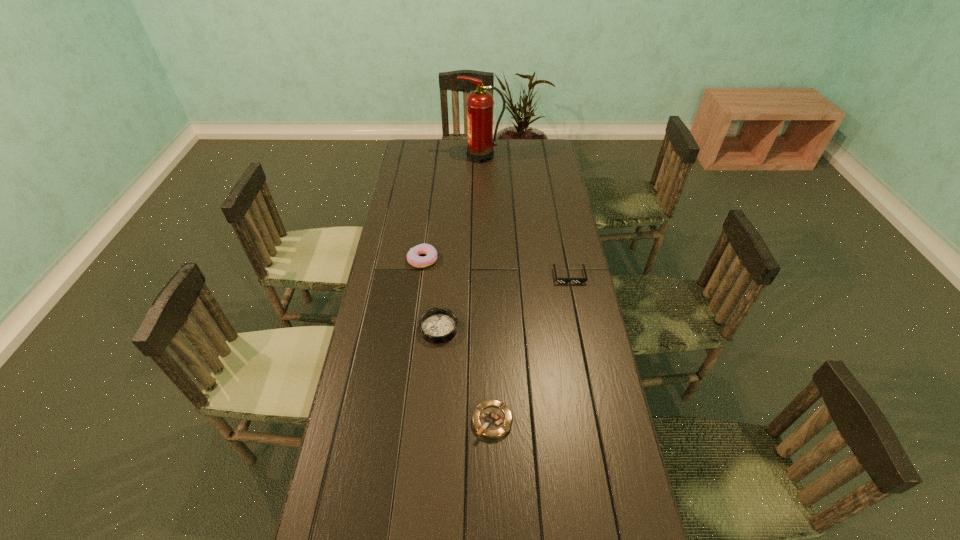
Locate an element on the screen. The height and width of the screenshot is (540, 960). vacant space positioned 0.200m on the front-facing side of the fire extinguisher is located at coordinates (420, 156).

Where is `blank space located 0.390m on the front of the fourth shortest object`? This screenshot has height=540, width=960. blank space located 0.390m on the front of the fourth shortest object is located at coordinates (410, 358).

You are a GUI agent. You are given a task and a screenshot of the screen. Output one action in this format:
    pyautogui.click(x=<x>, y=<y>)
    Task: Click on the vacant region located 0.120m on the left of the left ashtray
    The height and width of the screenshot is (540, 960).
    Given the screenshot: What is the action you would take?
    pyautogui.click(x=384, y=329)

Where is `vacant space located on the back of the nearer ashtray`? This screenshot has width=960, height=540. vacant space located on the back of the nearer ashtray is located at coordinates (492, 377).

Where is `vacant space located on the front-facing side of the sunglasses`? This screenshot has width=960, height=540. vacant space located on the front-facing side of the sunglasses is located at coordinates (586, 362).

The height and width of the screenshot is (540, 960). Identify the location of object present at the far edge. (481, 141).

Where is `object located at the left edge`? The width and height of the screenshot is (960, 540). object located at the left edge is located at coordinates (413, 258).

Find the location of `object that is positioned at the right edge`. object that is positioned at the right edge is located at coordinates (560, 280).

The image size is (960, 540). I want to click on free space at the far edge of the desktop, so click(456, 141).

In the image, there is a desktop. In order to click on vacant space at the left edge in this screenshot , I will do `click(413, 207)`.